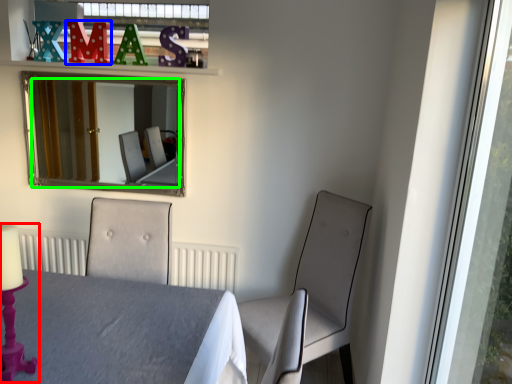
Question: Considering the real-world distances, which object is closest to candle holder (highlighted by a red box)? alphabet (highlighted by a blue box) or mirror (highlighted by a green box).

Choices:
 (A) alphabet
 (B) mirror

Answer: (A)